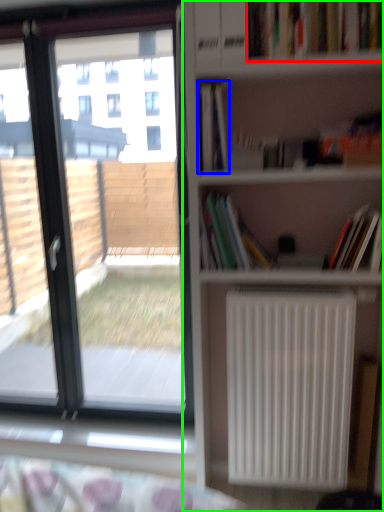
Question: Which is farther away from book (highlighted by a red box)? book (highlighted by a blue box) or bookcase (highlighted by a green box)?

Choices:
 (A) book
 (B) bookcase

Answer: (B)